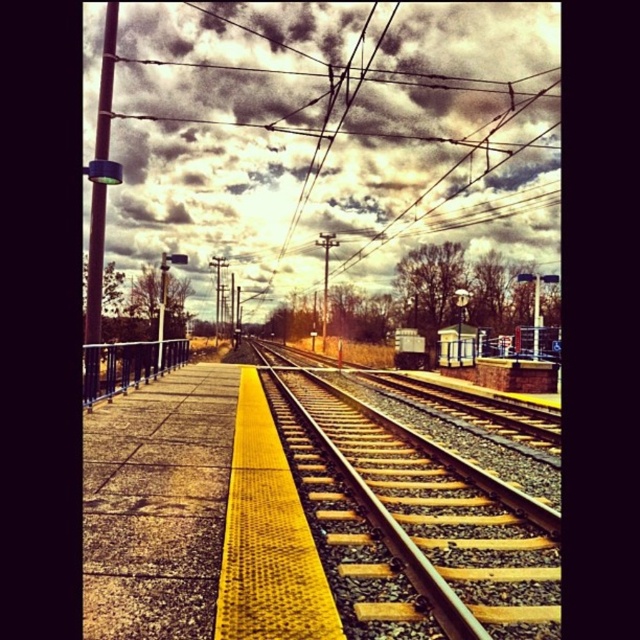
You are standing on the platform and want to cross from the yellow gravel track at center to the metallic wires at center. Which object is closer to you, making it easier to reach first?

The yellow gravel track at center is closer to the viewer than the metallic wires at center, so it is easier to reach first.

Consider the image. You are a maintenance worker on the platform and need to determine which object has a greater width between the metallic wires at center and the metallic railing at left. Which one is wider?

The metallic wires at center are wider than the metallic railing at left according to the description.